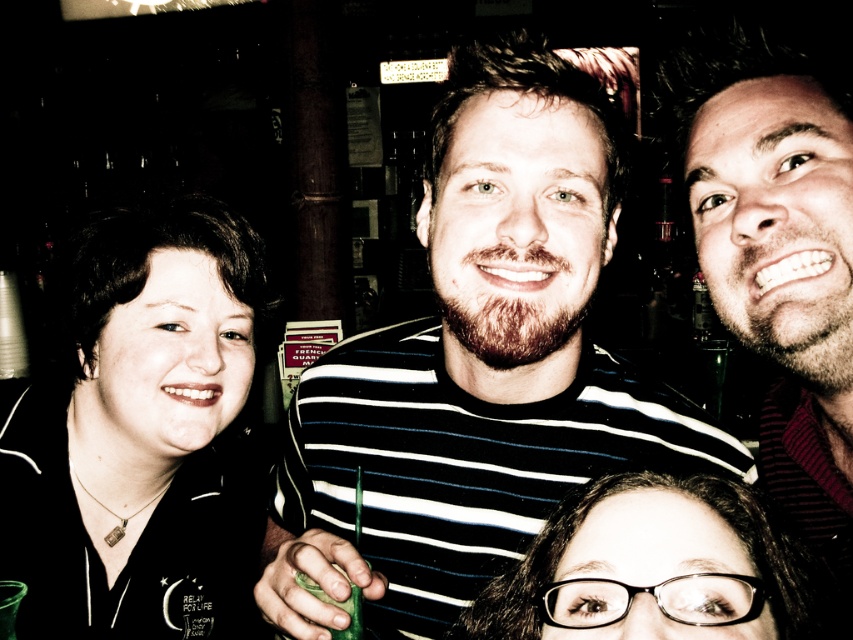
Question: Which object is closer to the camera taking this photo?

Choices:
 (A) clear plastic glasses at lower center
 (B) striped shirt at center

Answer: (A)

Question: Does clear plastic glasses at lower center have a smaller size compared to green matte glass at lower center?

Choices:
 (A) no
 (B) yes

Answer: (A)

Question: Based on their relative distances, which object is farther from the bearded man at center?

Choices:
 (A) striped shirt at center
 (B) green matte glass at lower center

Answer: (B)

Question: Does striped shirt at center appear over bearded man at center?

Choices:
 (A) yes
 (B) no

Answer: (B)

Question: Which is farther from the bearded man at center?

Choices:
 (A) clear plastic glasses at lower center
 (B) green matte glass at lower center

Answer: (B)

Question: Considering the relative positions of striped shirt at center and green matte glass at lower center in the image provided, where is striped shirt at center located with respect to green matte glass at lower center?

Choices:
 (A) left
 (B) right

Answer: (B)